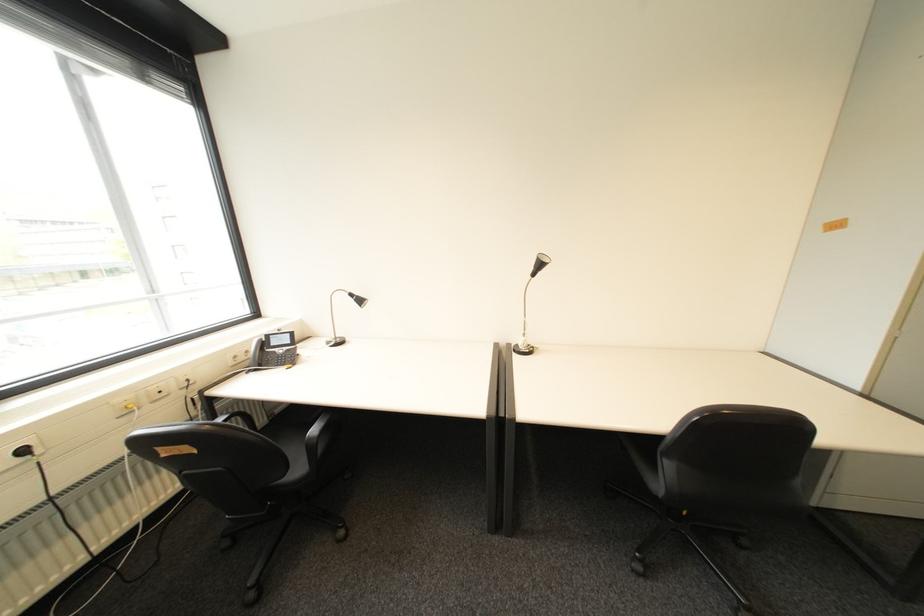
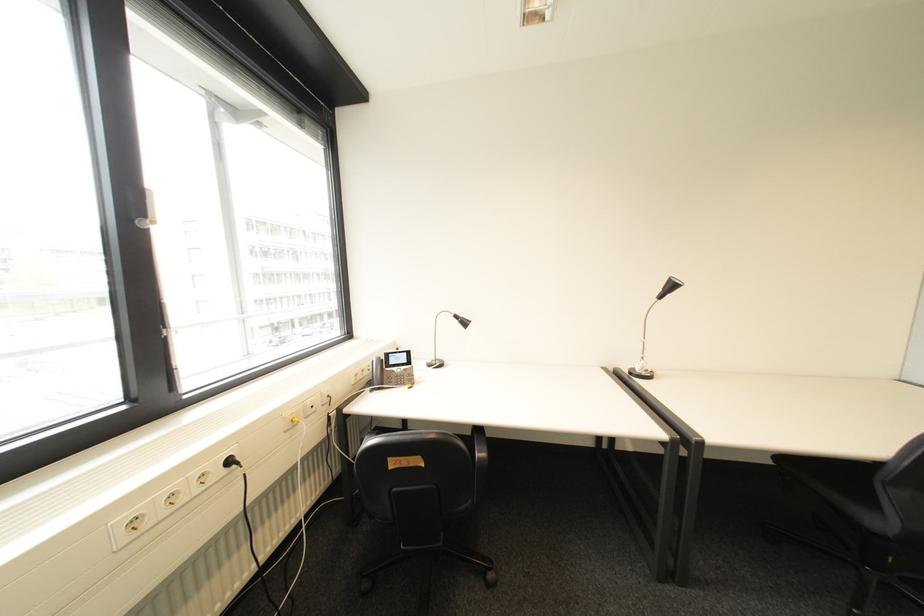
In the second image, find the point that corresponds to the point at 544,267 in the first image.

(673, 290)